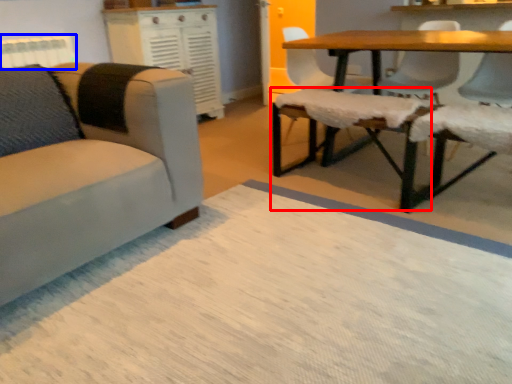
Question: Which object appears closest to the camera in this image, swivel chair (highlighted by a red box) or radiator (highlighted by a blue box)?

Choices:
 (A) swivel chair
 (B) radiator

Answer: (A)